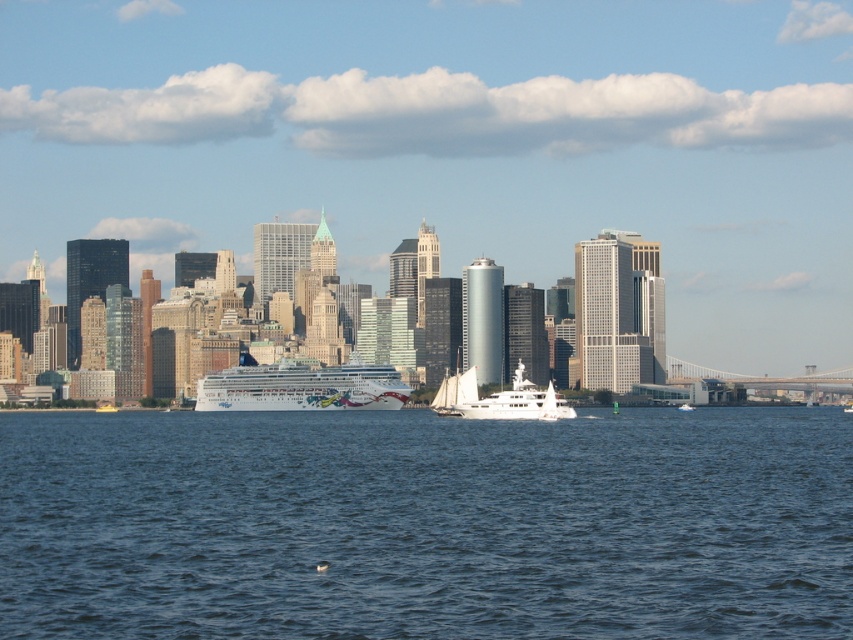
You are standing on the dock and see both the white glossy cruise ship at center and the white glossy sailboat at center. Which vessel is nearer to you?

The white glossy cruise ship at center is closer to the viewer than the white glossy sailboat at center.

You are a tourist standing on the dock and see the blue water at center and the white glossy sailboat at center. Which object is closer to your right side?

The white glossy sailboat at center is closer to your right side because the blue water at center is to the left of it.